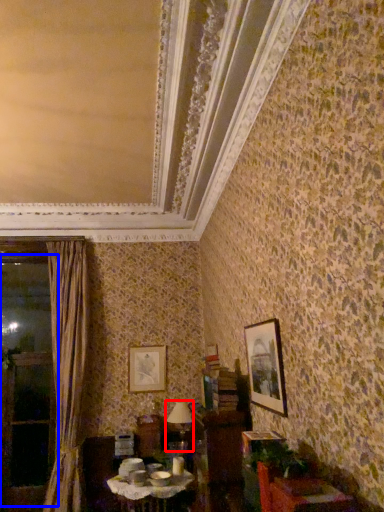
Question: Among these objects, which one is nearest to the camera, table lamp (highlighted by a red box) or window (highlighted by a blue box)?

Choices:
 (A) table lamp
 (B) window

Answer: (A)